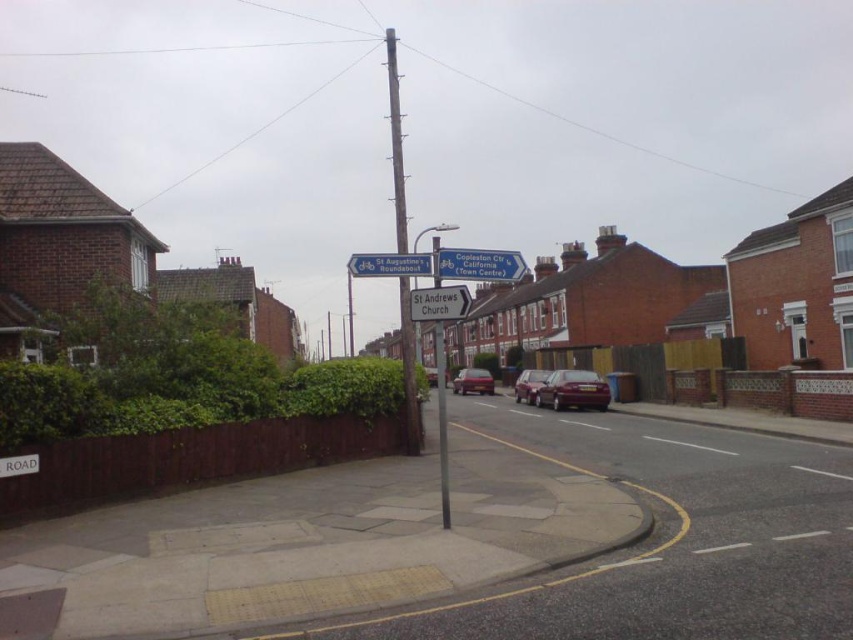
Question: Which of the following is the farthest from the observer?

Choices:
 (A) metallic pole at center
 (B) smooth gray pole at center
 (C) metallic silver car at center

Answer: (B)

Question: Which of the following is the closest to the observer?

Choices:
 (A) metallic silver car at center
 (B) matte red car at center

Answer: (A)

Question: Observing the image, what is the correct spatial positioning of metallic pole at center in reference to white plastic street sign at center?

Choices:
 (A) left
 (B) right

Answer: (B)

Question: Does white plastic street sign at upper center appear on the right side of matte red car at center?

Choices:
 (A) no
 (B) yes

Answer: (A)

Question: Observing the image, what is the correct spatial positioning of smooth gray pole at center in reference to matte red car at center?

Choices:
 (A) right
 (B) left

Answer: (B)

Question: Considering the real-world distances, which object is closest to the white plastic street sign at upper center?

Choices:
 (A) shiny metallic car at center
 (B) metallic maroon sedan at center
 (C) metallic silver car at center
 (D) matte red car at center

Answer: (B)